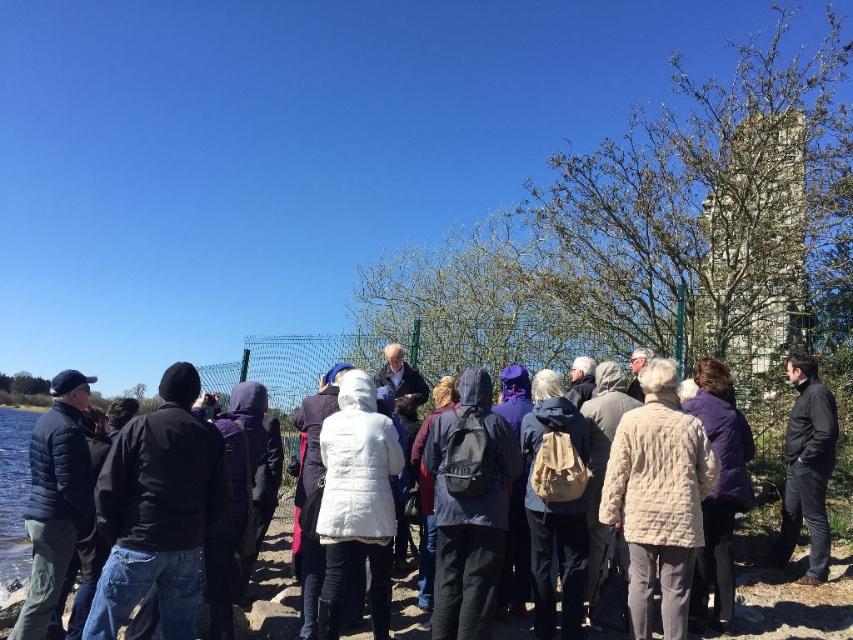
You are a photographer taking a picture of the group. You want to ensure that both the white wool coat at center and the black matte jacket at lower right are visible in the frame. Based on their positions, which one is lower in the image?

The white wool coat at center is below the black matte jacket at lower right, so it is lower in the image.